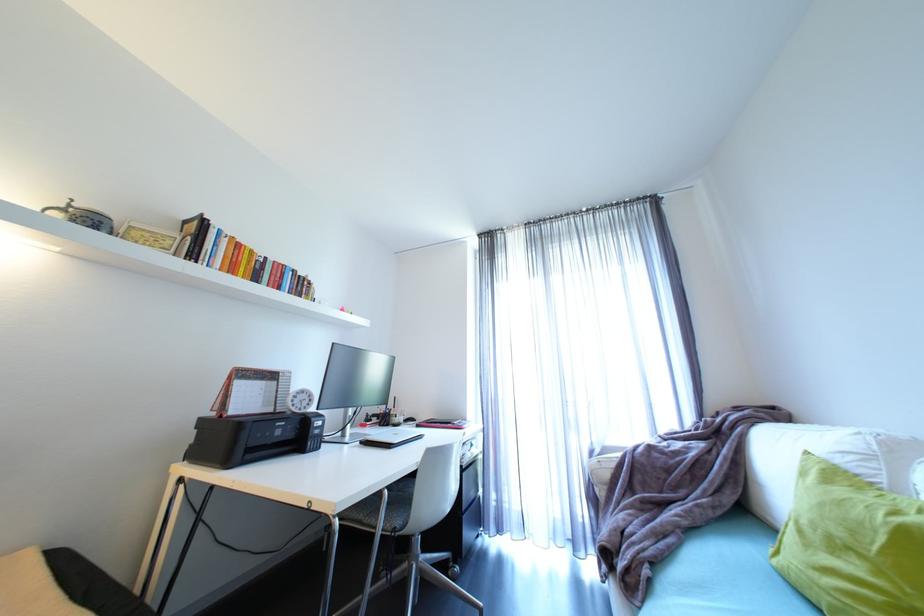
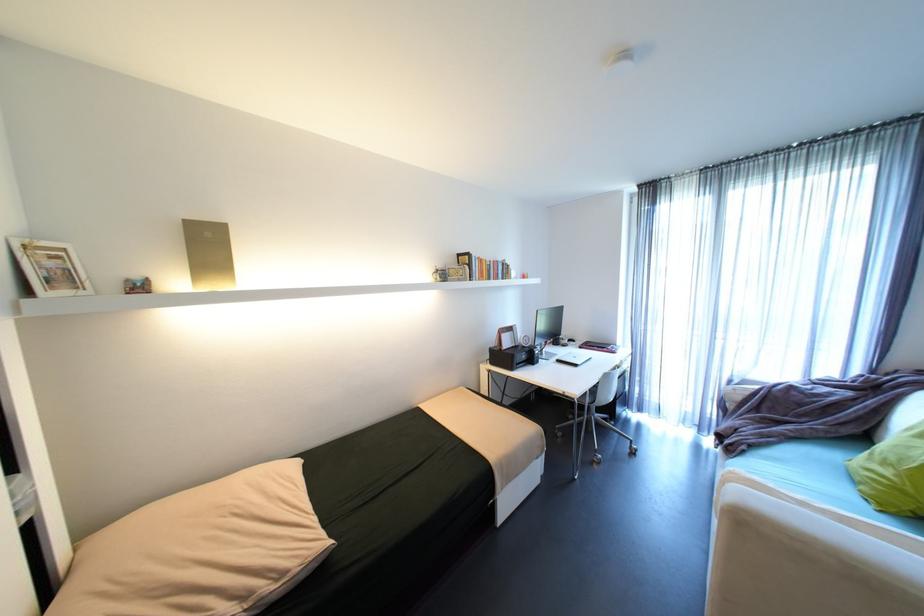
The point at [885,573] is marked in the first image. Where is the corresponding point in the second image?

(906, 476)